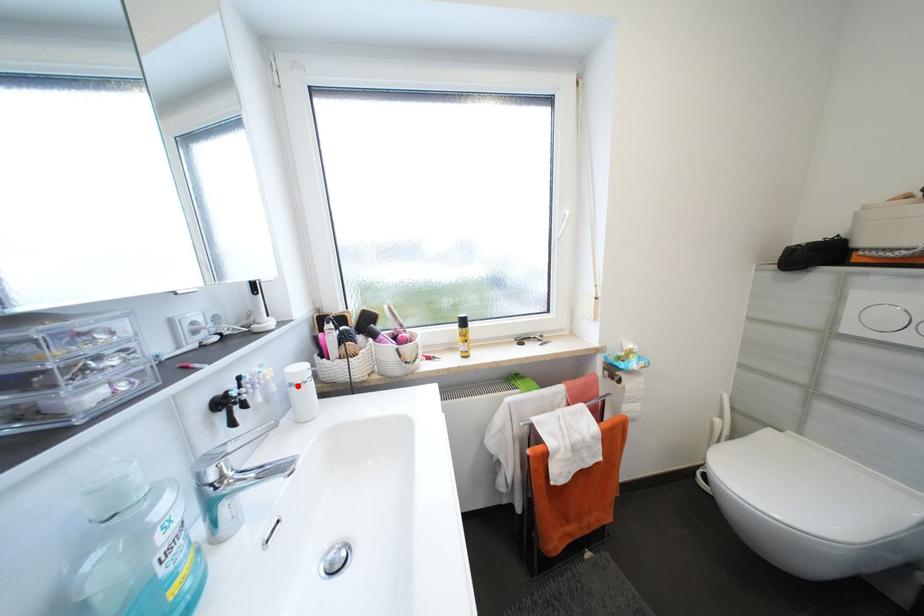
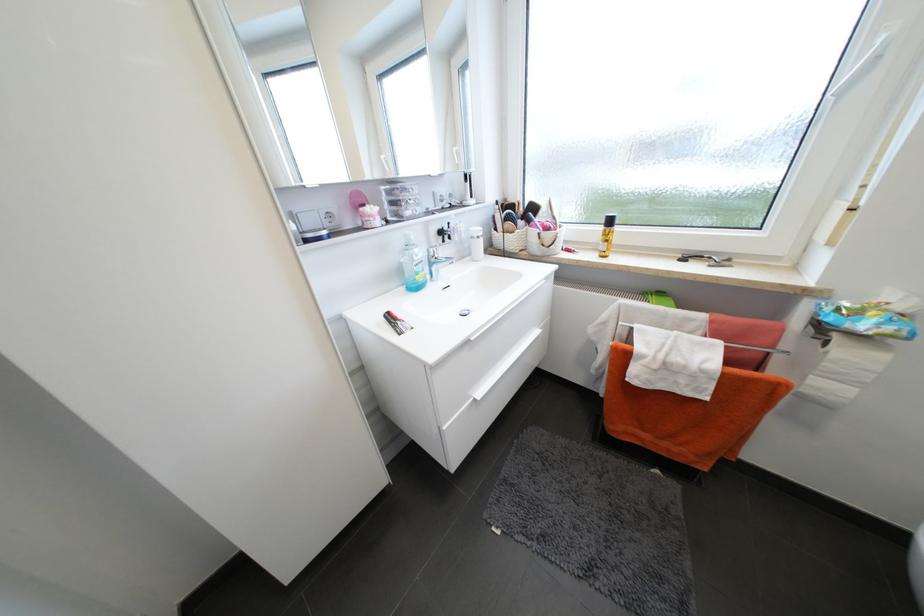
The point at the highlighted location is marked in the first image. Where is the corresponding point in the second image?

(478, 238)